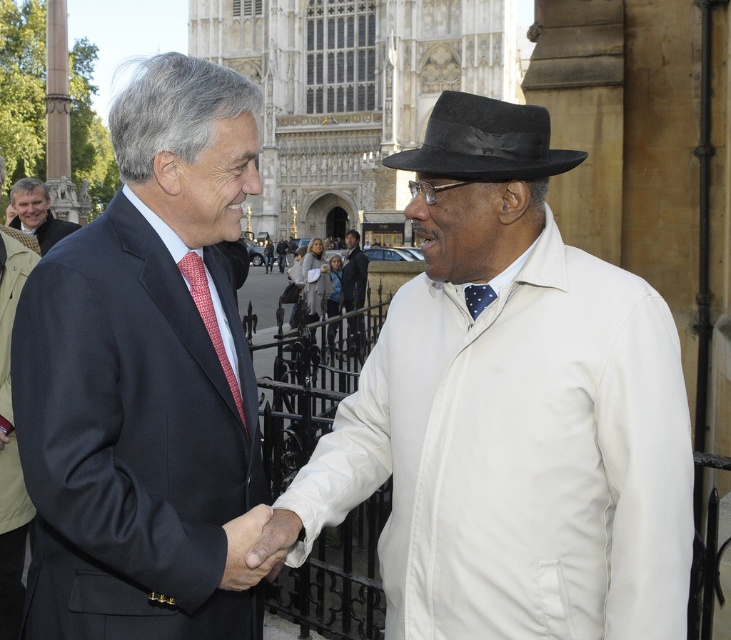
Does red dotted tie at left have a greater height compared to white cotton shirt at center?

No.

Identify the location of red dotted tie at left. The width and height of the screenshot is (731, 640). click(208, 320).

Can you confirm if red dotted tie at left is positioned below blue silk tie at center?

Correct, red dotted tie at left is located below blue silk tie at center.

Which is below, red dotted tie at left or blue silk tie at center?

red dotted tie at left is lower down.

Is point (197, 266) closer to viewer compared to point (469, 314)?

No, (197, 266) is behind (469, 314).

Find the location of a particular element. This screenshot has width=731, height=640. red dotted tie at left is located at coordinates (208, 320).

Can you confirm if matte black suit at upper left is positioned to the right of red dotted tie at left?

In fact, matte black suit at upper left is to the left of red dotted tie at left.

Between point (50, 237) and point (194, 262), which one is positioned in front?

Point (194, 262) is more forward.

Is point (37, 227) behind point (224, 353)?

Yes, point (37, 227) is farther from viewer.

Identify the location of matte black suit at upper left. (37, 212).